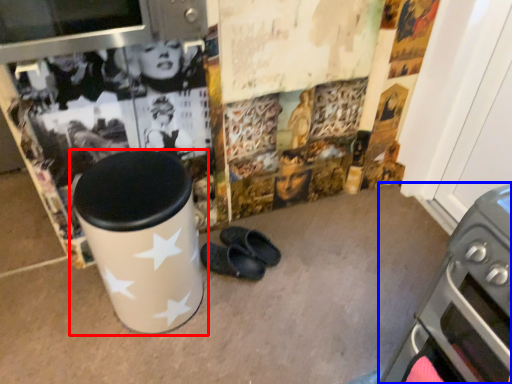
Question: Among these objects, which one is nearest to the camera, waste container (highlighted by a red box) or home appliance (highlighted by a blue box)?

Choices:
 (A) waste container
 (B) home appliance

Answer: (B)